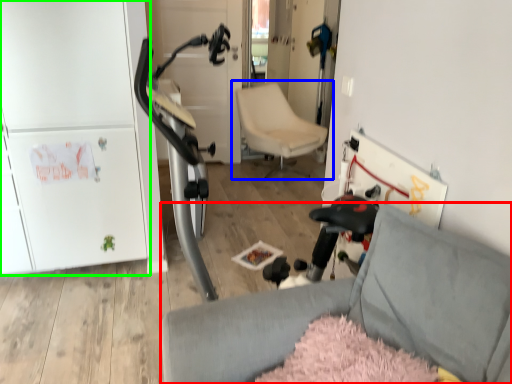
Question: Estimate the real-world distances between objects in this image. Which object is farther from chair (highlighted by a red box), chair (highlighted by a blue box) or fridge (highlighted by a green box)?

Choices:
 (A) chair
 (B) fridge

Answer: (A)